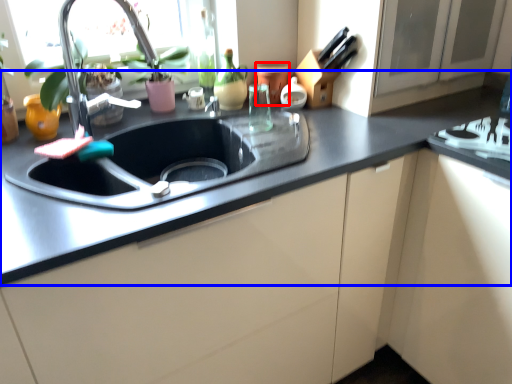
Question: Which object appears farthest to the camera in this image, appliance (highlighted by a red box) or countertop (highlighted by a blue box)?

Choices:
 (A) appliance
 (B) countertop

Answer: (A)